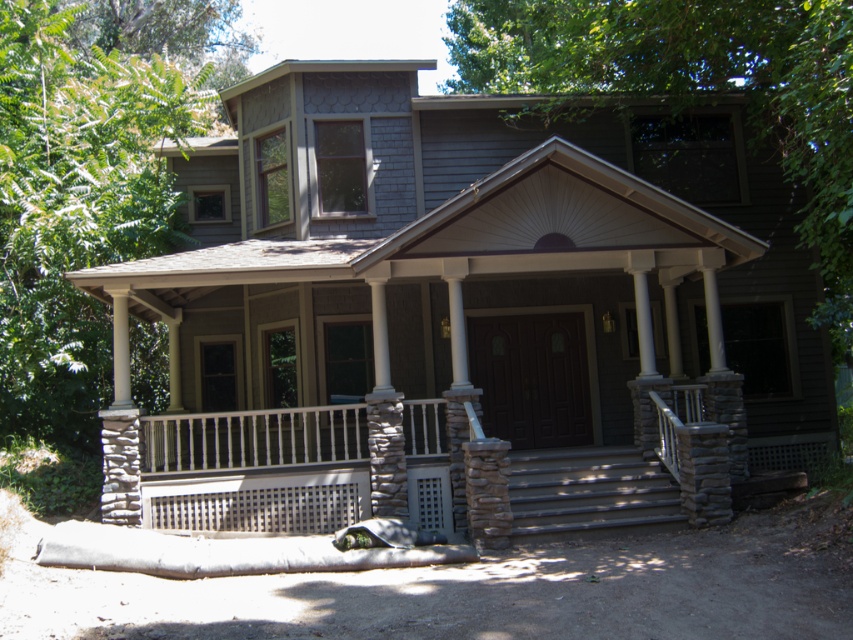
Question: Can you confirm if stone textured porch at center is thinner than gray stone stairs at center?

Choices:
 (A) yes
 (B) no

Answer: (A)

Question: Which point is farther to the camera?

Choices:
 (A) (633, 508)
 (B) (300, 496)

Answer: (B)

Question: Which point is farther to the camera?

Choices:
 (A) gray stone stairs at center
 (B) stone textured porch at center

Answer: (B)

Question: Observing the image, what is the correct spatial positioning of stone textured porch at center in reference to gray stone stairs at center?

Choices:
 (A) above
 (B) below

Answer: (A)

Question: Is stone textured porch at center above gray stone stairs at center?

Choices:
 (A) no
 (B) yes

Answer: (B)

Question: Which object appears closest to the camera in this image?

Choices:
 (A) stone textured porch at center
 (B) gray stone stairs at center

Answer: (B)